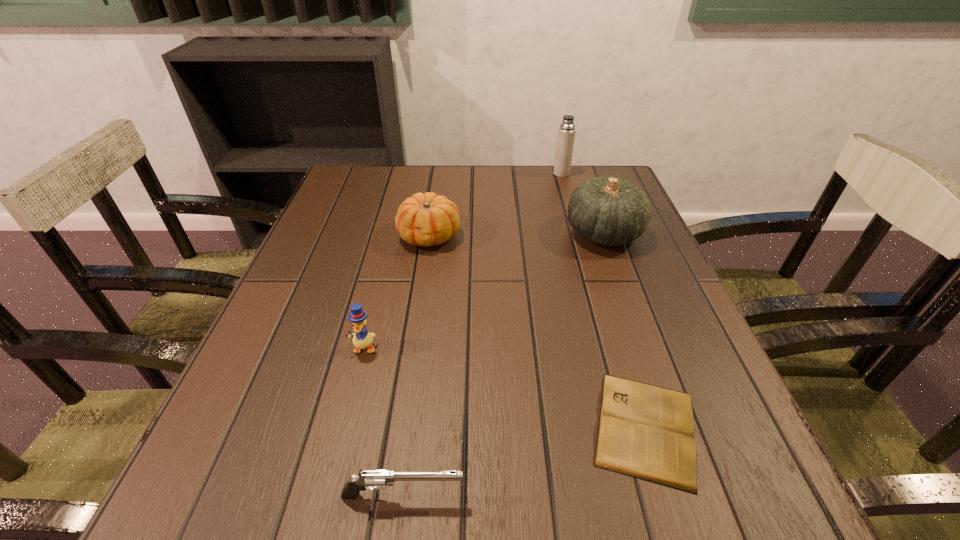
In the image, there is a desktop. Where is `blank space at the far edge`? This screenshot has width=960, height=540. blank space at the far edge is located at coordinates (564, 193).

The height and width of the screenshot is (540, 960). In the image, there is a desktop. Identify the location of vacant space at the near edge. (464, 507).

I want to click on free space at the left edge, so click(285, 385).

The image size is (960, 540). In order to click on vacant area at the right edge of the desktop in this screenshot , I will do `click(641, 268)`.

The height and width of the screenshot is (540, 960). Find the location of `vacant space at the far right corner of the desktop`. vacant space at the far right corner of the desktop is located at coordinates (x=622, y=179).

At what (x,y) coordinates should I click in order to perform the action: click on unoccupied position between the book and the pistol. Please return your answer as a coordinate pair (x, y). The width and height of the screenshot is (960, 540). Looking at the image, I should click on (524, 462).

What are the coordinates of `vacant area that lies between the book and the shorter gourd` in the screenshot? It's located at (538, 332).

You are a GUI agent. You are given a task and a screenshot of the screen. Output one action in this format:
    pyautogui.click(x=<x>, y=<y>)
    Task: Click on the free space that is in between the right gourd and the duckling
    
    Given the screenshot: What is the action you would take?
    pyautogui.click(x=484, y=291)

Locate an element on the screen. vacant region between the right gourd and the fifth tallest object is located at coordinates (503, 364).

You are a GUI agent. You are given a task and a screenshot of the screen. Output one action in this format:
    pyautogui.click(x=<x>, y=<y>)
    Task: Click on the vacant space that's between the book and the right gourd
    This screenshot has height=540, width=960.
    Given the screenshot: What is the action you would take?
    pyautogui.click(x=624, y=330)